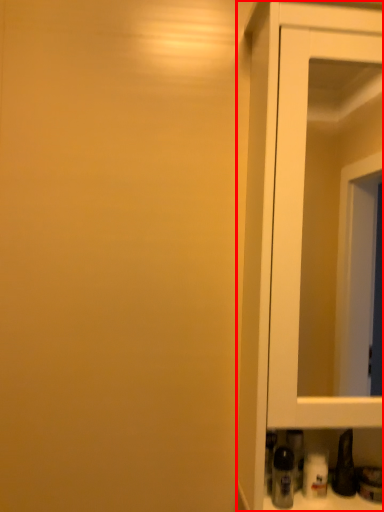
Question: From the image's perspective, where is cupboard (annotated by the red box) located in relation to bottle in the image?

Choices:
 (A) below
 (B) above

Answer: (B)